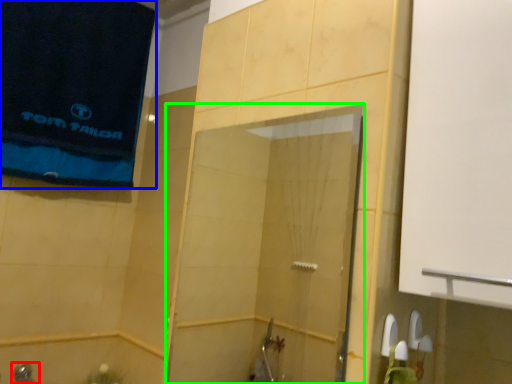
Question: Estimate the real-world distances between objects in this image. Which object is closer to shower (highlighted by a red box), beach towel (highlighted by a blue box) or screen door (highlighted by a green box)?

Choices:
 (A) beach towel
 (B) screen door

Answer: (A)